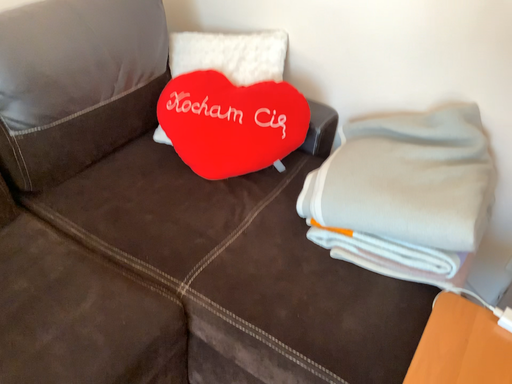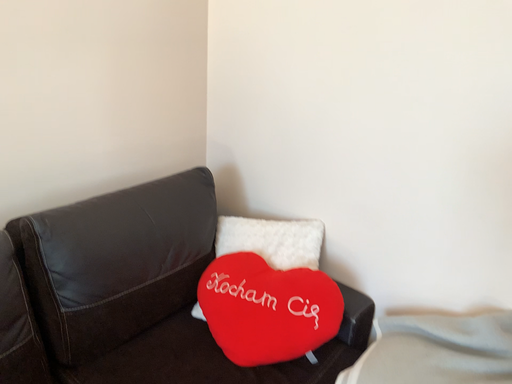
Question: Which way did the camera rotate in the video?

Choices:
 (A) rotated upward
 (B) rotated downward

Answer: (A)